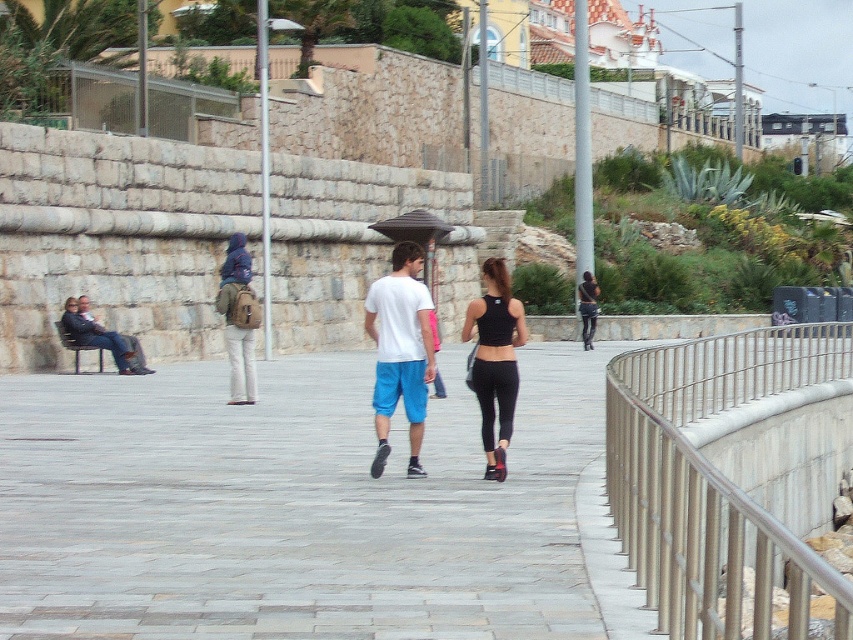
Question: Is black fabric umbrella at center to the left of black leather pants at center from the viewer's perspective?

Choices:
 (A) no
 (B) yes

Answer: (B)

Question: Estimate the real-world distances between objects in this image. Which object is farther from the black leather pants at center?

Choices:
 (A) white cotton t-shirt at center
 (B) black fabric umbrella at center
 (C) matte white t-shirt at center
 (D) silver metallic railing at right

Answer: (A)

Question: Does black matte tank top at center appear on the left side of matte brown backpack at center?

Choices:
 (A) yes
 (B) no

Answer: (B)

Question: Can you confirm if matte brown backpack at center is bigger than black fabric umbrella at center?

Choices:
 (A) yes
 (B) no

Answer: (B)

Question: Which point is farther from the camera taking this photo?

Choices:
 (A) (387, 285)
 (B) (476, 300)
 (C) (405, 232)

Answer: (C)

Question: Which point is farther from the camera taking this photo?

Choices:
 (A) (381, 312)
 (B) (393, 381)

Answer: (A)